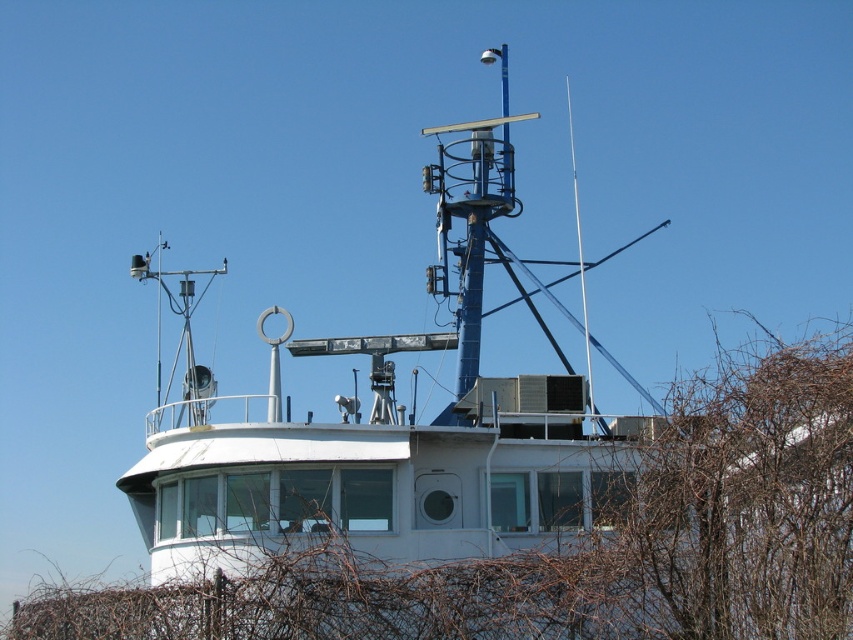
Can you confirm if brown leafless branches at lower right is positioned to the right of white matte boat at center?

Correct, you'll find brown leafless branches at lower right to the right of white matte boat at center.

Is point (169, 528) behind point (299, 444)?

Yes, it is behind point (299, 444).

In order to click on brown leafless branches at lower right in this screenshot , I will do `click(502, 522)`.